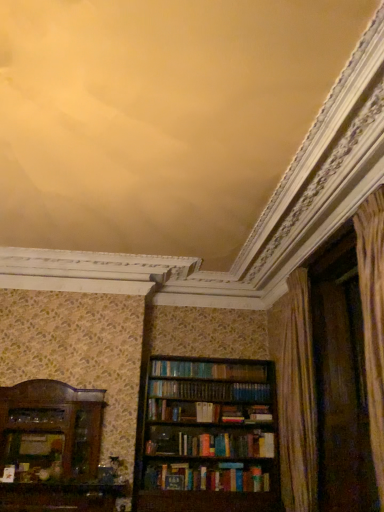
You are a GUI agent. You are given a task and a screenshot of the screen. Output one action in this format:
    pyautogui.click(x=<x>, y=<y>)
    Task: Click on the wooden bookcase at center
    
    Given the screenshot: What is the action you would take?
    pyautogui.click(x=208, y=437)

Describe the element at coordinates (208, 437) in the screenshot. I see `wooden bookcase at center` at that location.

The image size is (384, 512). I want to click on wooden bookcase at center, so click(208, 437).